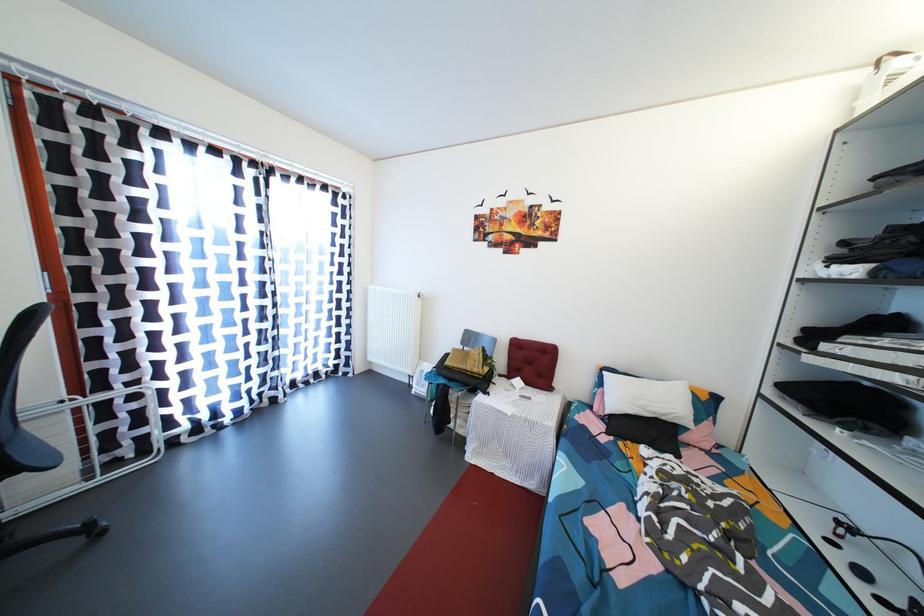
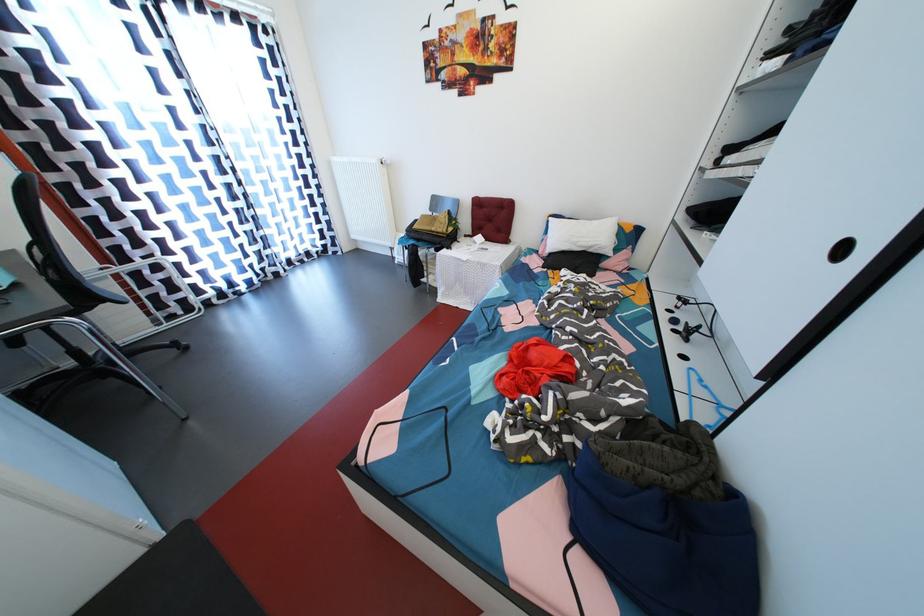
Locate, in the second image, the point that corresponds to (671,416) in the first image.

(597, 249)